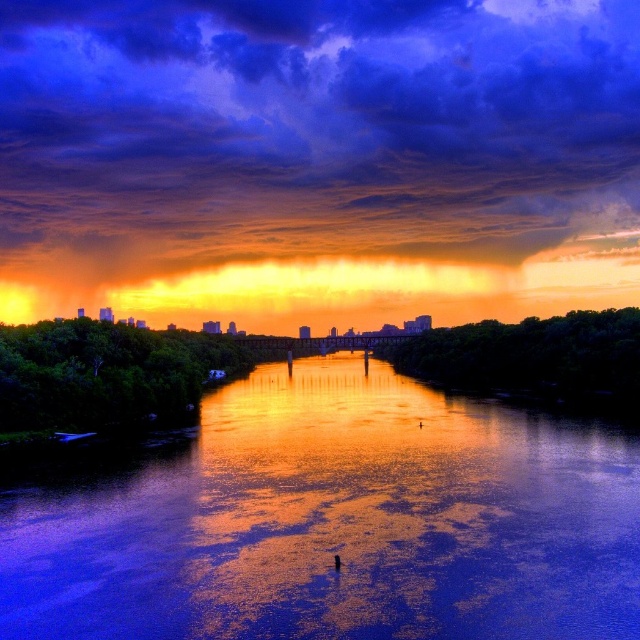
Question: Is orange/yellow cloud at upper center thinner than glossy reflective water at center?

Choices:
 (A) no
 (B) yes

Answer: (A)

Question: Does orange/yellow cloud at upper center have a greater width compared to glossy reflective water at center?

Choices:
 (A) yes
 (B) no

Answer: (A)

Question: Which object appears closest to the camera in this image?

Choices:
 (A) orange/yellow cloud at upper center
 (B) glossy reflective water at center

Answer: (B)

Question: Is orange/yellow cloud at upper center bigger than glossy reflective water at center?

Choices:
 (A) no
 (B) yes

Answer: (B)

Question: Which point is farther to the camera?

Choices:
 (A) (356, 515)
 (B) (10, 38)

Answer: (B)